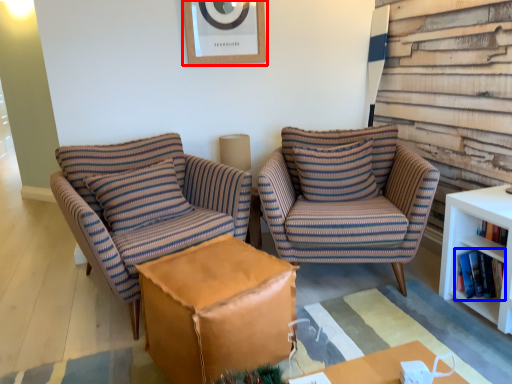
Question: Which object is further to the camera taking this photo, picture frame (highlighted by a red box) or book (highlighted by a blue box)?

Choices:
 (A) picture frame
 (B) book

Answer: (A)